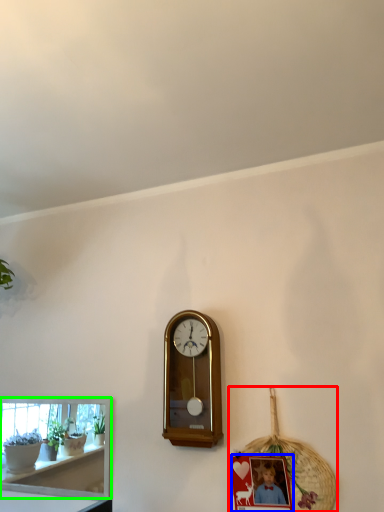
Question: Estimate the real-world distances between objects in this image. Which object is closer to basket (highlighted by a red box), picture frame (highlighted by a blue box) or shelf (highlighted by a green box)?

Choices:
 (A) picture frame
 (B) shelf

Answer: (A)